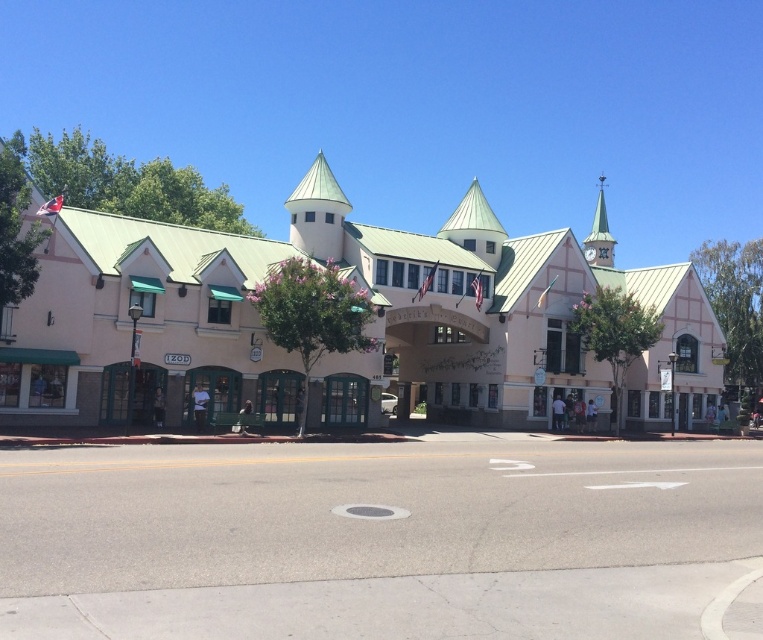
Question: Does pink matte building at center appear over metallic spire at upper right?

Choices:
 (A) yes
 (B) no

Answer: (B)

Question: Which of the following is the closest to the observer?

Choices:
 (A) (601, 236)
 (B) (262, 400)

Answer: (B)

Question: Can you confirm if pink matte building at center is bigger than metallic spire at upper right?

Choices:
 (A) no
 (B) yes

Answer: (A)

Question: Does pink matte building at center have a smaller size compared to metallic spire at upper right?

Choices:
 (A) no
 (B) yes

Answer: (B)